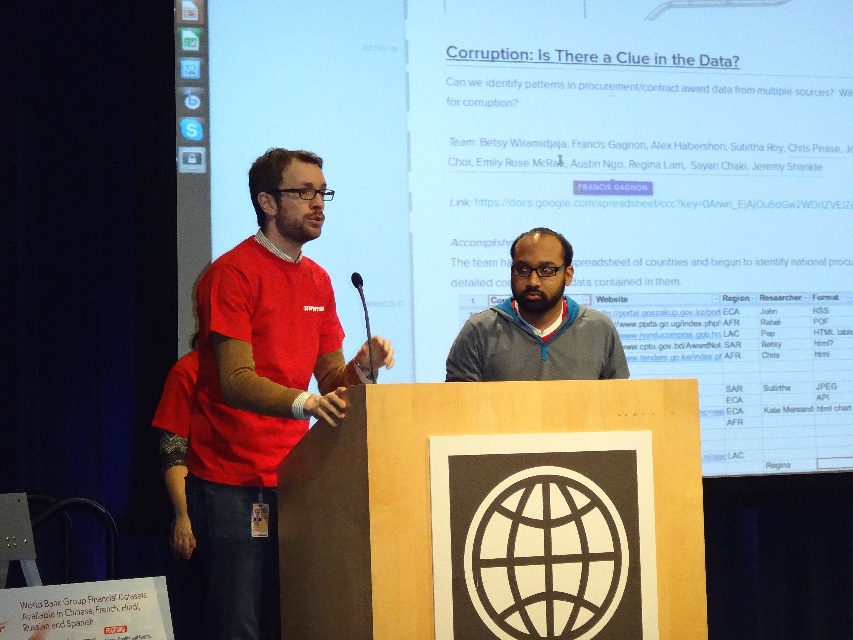
What is the color of the shirt worn by the person standing at the point with coordinates (260, 388)?

The point at coordinates (260, 388) corresponds to the matte red shirt at left.

You are organizing a conference and need to ensure that all speakers have enough space to move around. The conference rules state that each speaker must have at least 1.2 meters of personal space. Given the size difference between the matte red shirt at left and the matte gray hoodie at center, do you think the current spacing between them allows for both to have adequate space?

The matte red shirt at left is bigger than the matte gray hoodie at center. Since the conference requires at least 1.2 meters of personal space for each speaker, the size difference suggests that the larger individual may need more space. However, without specific measurements of the distance between them, it is impossible to determine if the current spacing meets the requirement. Additional information about their actual separation is needed to make an accurate assessment.